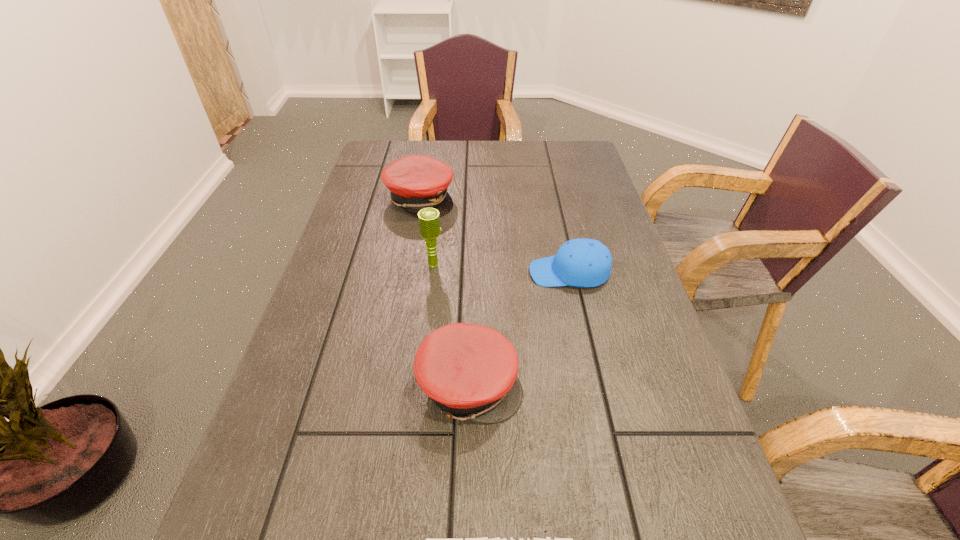
The width and height of the screenshot is (960, 540). What are the coordinates of `free spot between the tallest object and the second farthest cap` in the screenshot? It's located at (501, 269).

Identify the location of empty location between the microphone and the third nearest cap. (501, 269).

This screenshot has width=960, height=540. Identify the location of empty location between the fourth farthest object and the second farthest cap. (519, 329).

Locate an element on the screen. Image resolution: width=960 pixels, height=540 pixels. object that is the fourth closest one to the farthest cap is located at coordinates (485, 539).

Identify which object is located as the third nearest to the tallest object. Please provide its 2D coordinates. Your answer should be formatted as a tuple, i.e. [(x, y)], where the tuple contains the x and y coordinates of a point satisfying the conditions above.

[(469, 371)]

Select which cap appears as the second closest to the third nearest cap. Please provide its 2D coordinates. Your answer should be formatted as a tuple, i.e. [(x, y)], where the tuple contains the x and y coordinates of a point satisfying the conditions above.

[(416, 182)]

At what (x,y) coordinates should I click in order to perform the action: click on cap that is the nearest to the second nearest cap. Please return your answer as a coordinate pair (x, y). This screenshot has width=960, height=540. Looking at the image, I should click on (581, 262).

The height and width of the screenshot is (540, 960). Identify the location of vacant space that satisfies the following two spatial constraints: 1. on the back side of the tallest object; 2. at the front of the farthest cap where the visor is located. (442, 199).

Find the location of a particular element. vacant position in the image that satisfies the following two spatial constraints: 1. at the front of the tallest object where the visor is located; 2. on the left side of the farthest object is located at coordinates (408, 265).

At what (x,y) coordinates should I click in order to perform the action: click on vacant space that satisfies the following two spatial constraints: 1. at the front of the farthest cap where the visor is located; 2. on the left side of the microphone. Please return your answer as a coordinate pair (x, y). Looking at the image, I should click on (408, 265).